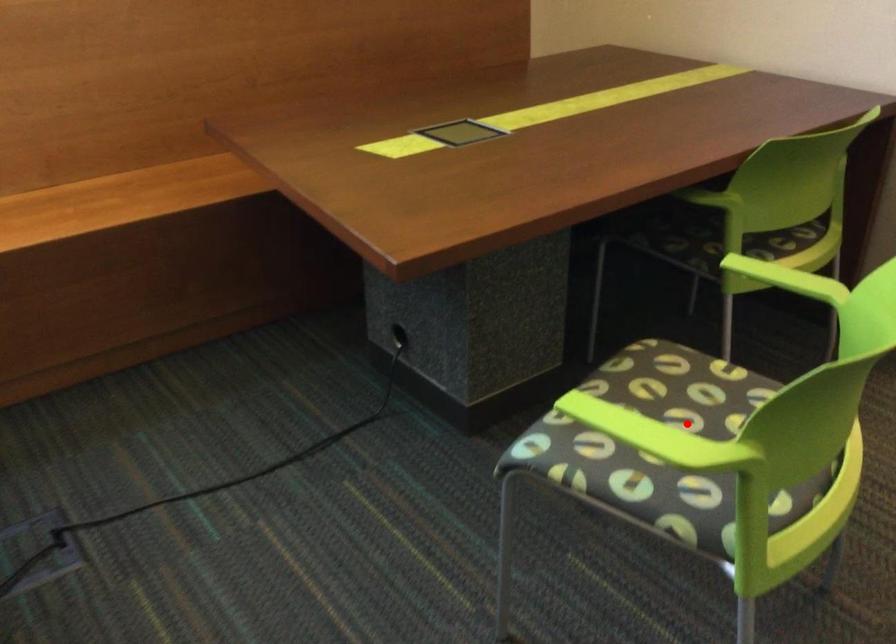
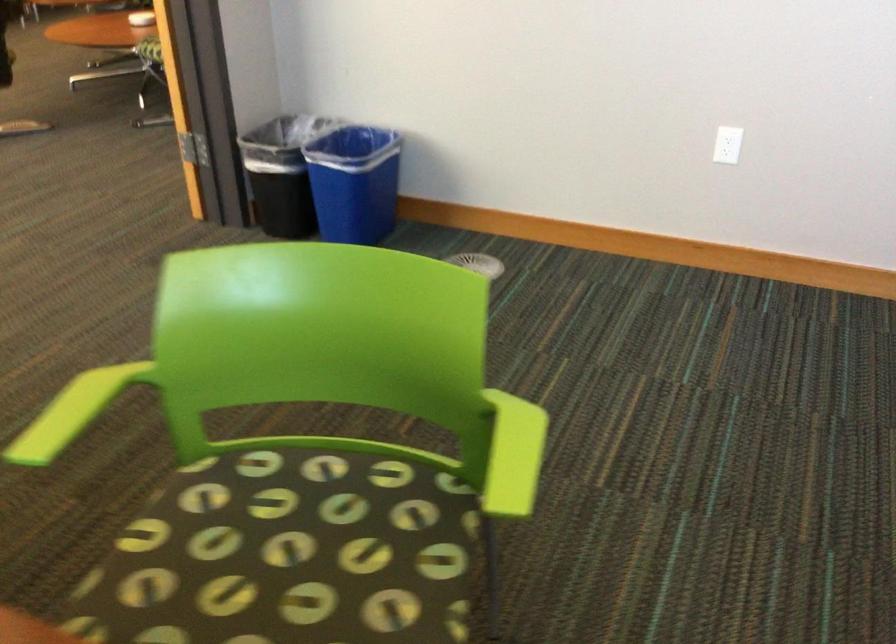
Question: A red point is marked in image1. In image2, is the corresponding 3D point closer to the camera or farther? Reply with the corresponding letter.

Choices:
 (A) The corresponding 3D point is closer.
 (B) The corresponding 3D point is farther.

Answer: (A)